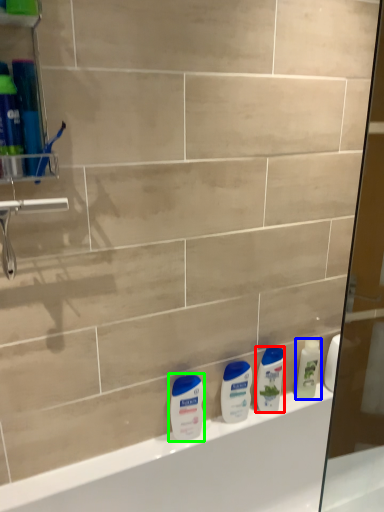
Question: Which object is positioned closest to cleaning product (highlighted by a red box)? Select from cleaning product (highlighted by a blue box) and toiletry (highlighted by a green box).

Choices:
 (A) cleaning product
 (B) toiletry

Answer: (A)